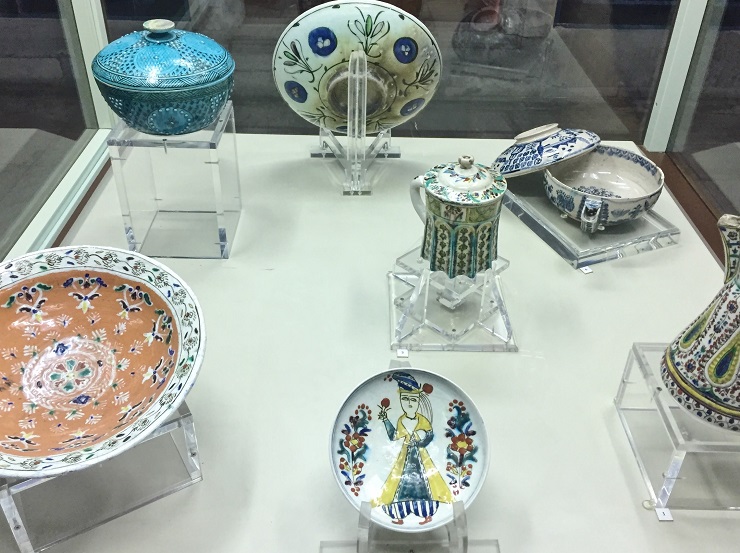
At what (x,y) coordinates should I click in order to perform the action: click on handle. Please return your answer as a coordinate pair (x, y). This screenshot has height=553, width=740. Looking at the image, I should click on (414, 179).